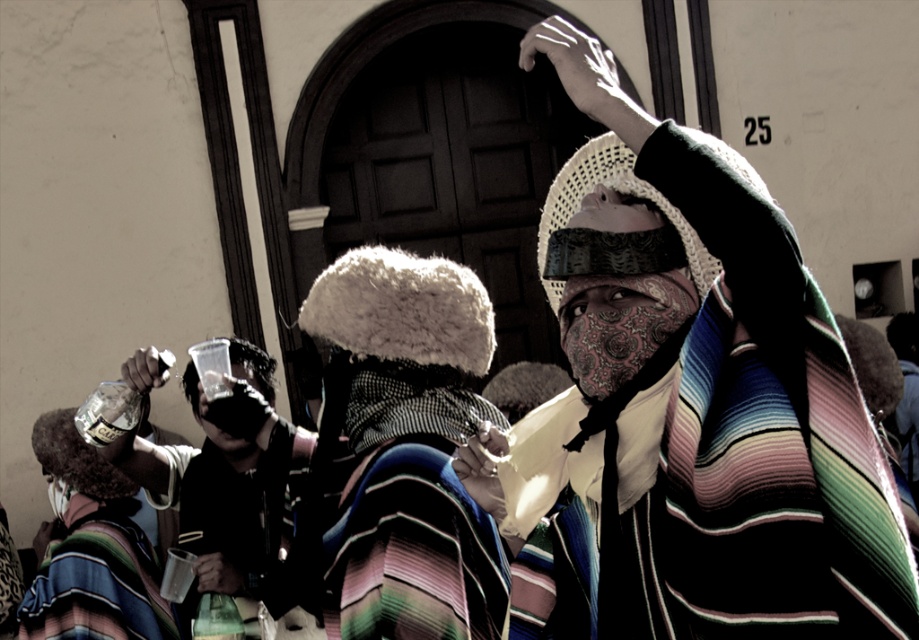
Question: Which of the following is the closest to the observer?

Choices:
 (A) click(258, 531)
 (B) click(825, 372)
 (C) click(214, 561)

Answer: (B)

Question: Based on their relative distances, which object is farther from the patterned fabric mask at center?

Choices:
 (A) striped woolen shawl at center
 (B) striped woolen robe at center
 (C) metallic silver cup at lower left

Answer: (C)

Question: Is striped woolen shawl at upper right positioned behind white matte hand at upper center?

Choices:
 (A) yes
 (B) no

Answer: (B)

Question: In this image, where is striped woolen shawl at upper right located relative to striped woolen shawl at center?

Choices:
 (A) above
 (B) below

Answer: (A)

Question: Which point is closer to the camera?

Choices:
 (A) (341, 556)
 (B) (616, 209)

Answer: (B)

Question: Can you confirm if striped woolen shawl at upper right is thinner than matte black face at center?

Choices:
 (A) no
 (B) yes

Answer: (A)